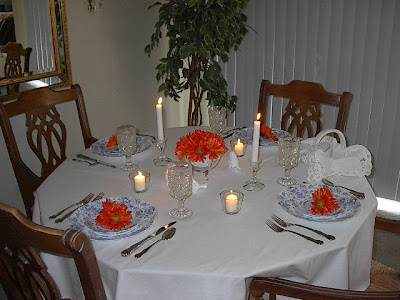
You are a GUI agent. You are given a task and a screenshot of the screen. Output one action in this format:
    pyautogui.click(x=<x>, y=<y>)
    Task: Click on the candles in the image
    This screenshot has width=400, height=300.
    Given the screenshot: What is the action you would take?
    pyautogui.click(x=255, y=140), pyautogui.click(x=239, y=146), pyautogui.click(x=233, y=197), pyautogui.click(x=140, y=179), pyautogui.click(x=160, y=133)